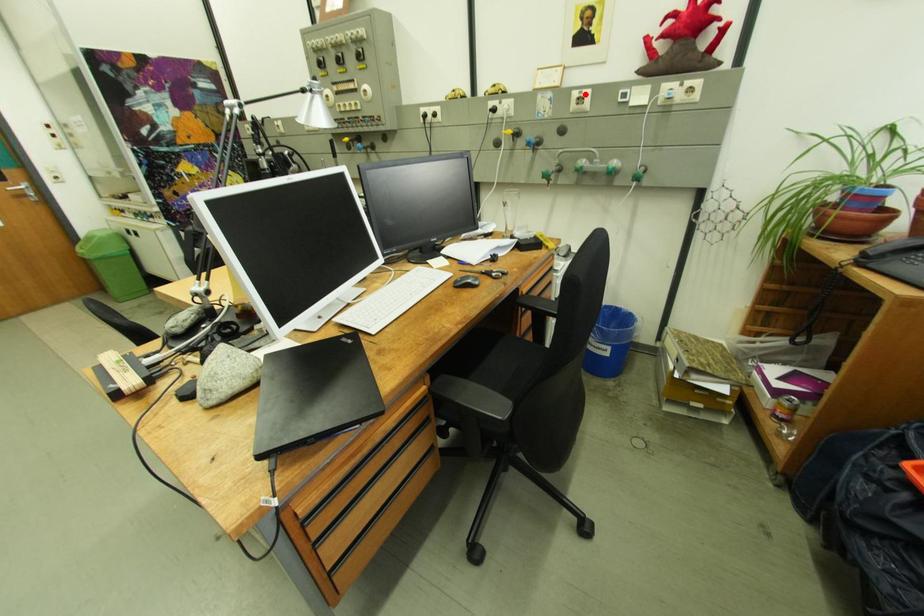
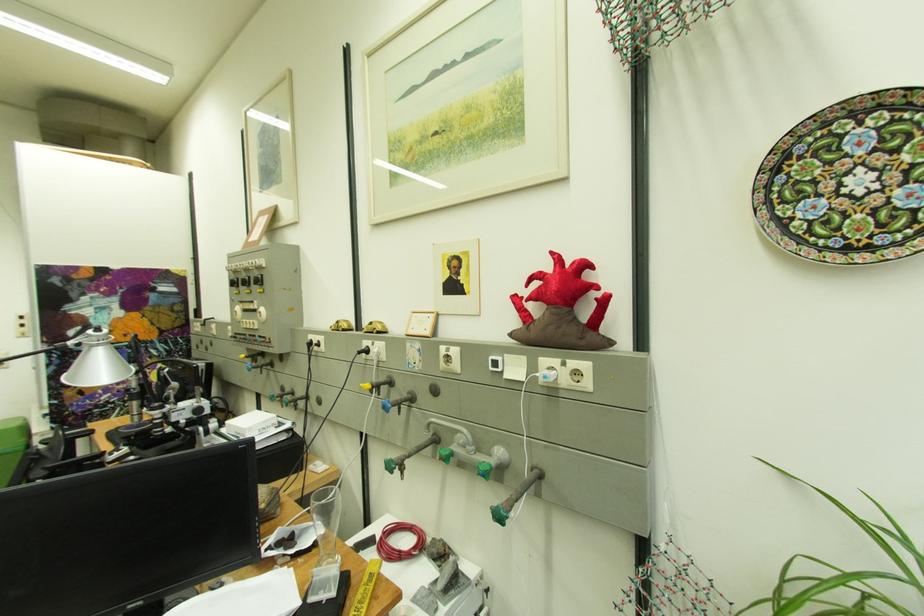
The point at the highlighted location is marked in the first image. Where is the corresponding point in the second image?

(454, 351)